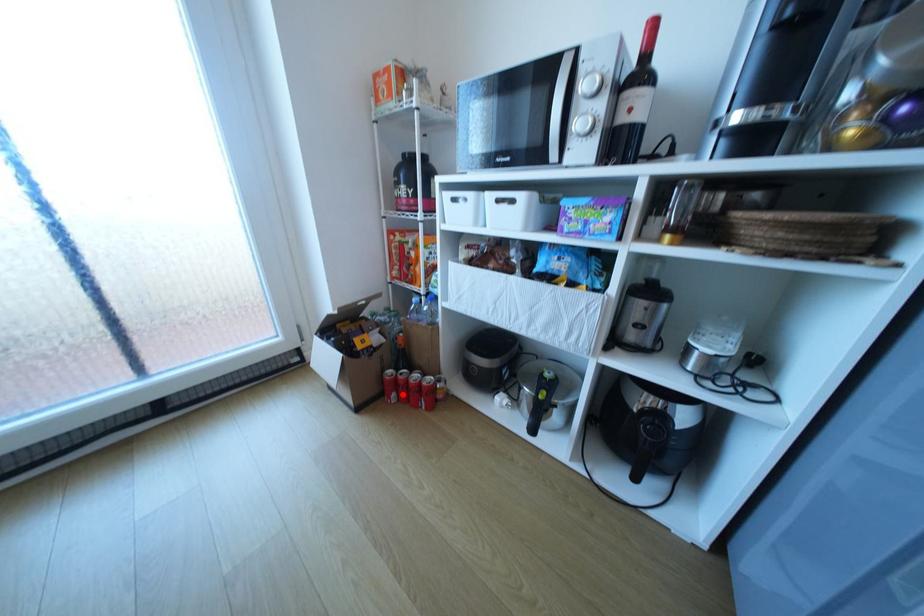
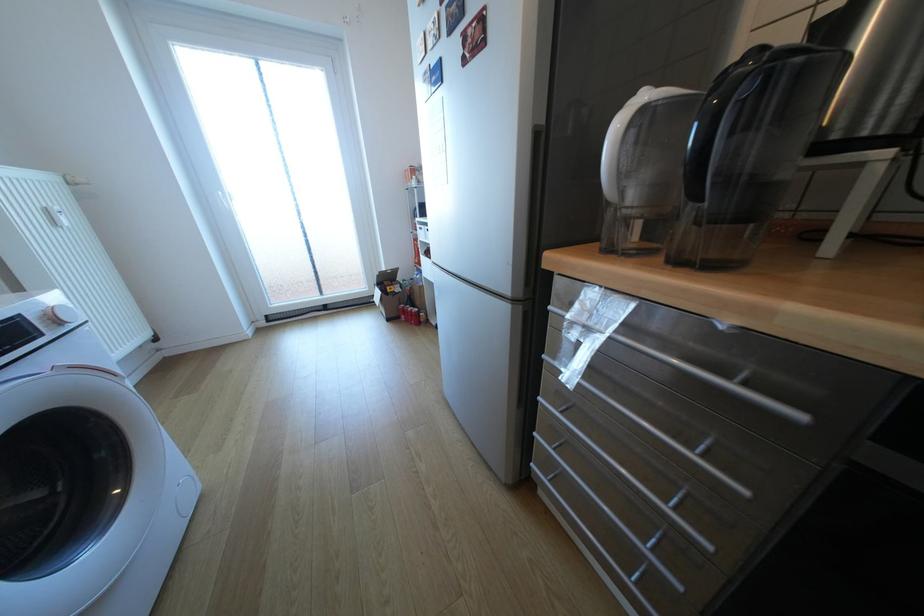
Question: I am providing you with two images of the same scene from different viewpoints. In image1, a red point is highlighted. Considering the same 3D point in image2, which of the following is correct?

Choices:
 (A) It is closer
 (B) It is farther

Answer: (A)